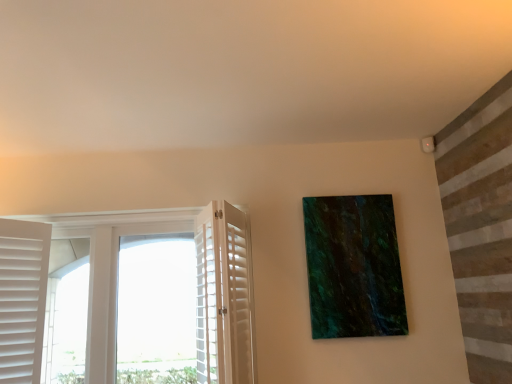
Locate an element on the screen. The height and width of the screenshot is (384, 512). white wooden shutters at left is located at coordinates 109,270.

This screenshot has width=512, height=384. What do you see at coordinates (224, 296) in the screenshot?
I see `white wood screen door at left` at bounding box center [224, 296].

At what (x,y) coordinates should I click in order to perform the action: click on white wooden shutters at left. Please return your answer as a coordinate pair (x, y). This screenshot has width=512, height=384. Looking at the image, I should click on (109, 270).

From a real-world perspective, which is physically below, green marble painting at upper right or white wooden shutters at left?

white wooden shutters at left is physically lower.

Does green marble painting at upper right have a lesser height compared to white wooden shutters at left?

Correct, green marble painting at upper right is not as tall as white wooden shutters at left.

Based on the photo, is green marble painting at upper right turned away from white wooden shutters at left?

That's not correct — green marble painting at upper right is not looking away from white wooden shutters at left.

At what (x,y) coordinates should I click in order to perform the action: click on picture frame behind the white wooden shutters at left. Please return your answer as a coordinate pair (x, y). This screenshot has width=512, height=384. Looking at the image, I should click on (353, 267).

Which object is closer to the camera taking this photo, white wood screen door at left or white wooden shutters at left?

white wood screen door at left is more forward.

Is white wood screen door at left taller or shorter than white wooden shutters at left?

white wood screen door at left is shorter than white wooden shutters at left.

Which of these two, white wood screen door at left or white wooden shutters at left, is thinner?

Thinner between the two is white wood screen door at left.

Find the location of a particular element. window that appears behind the white wood screen door at left is located at coordinates pyautogui.click(x=109, y=270).

Does point (101, 267) lie in front of point (240, 234)?

No, (101, 267) is behind (240, 234).

In the scene shown: Would you say white wooden shutters at left is to the left or to the right of white wood screen door at left in the picture?

white wooden shutters at left is positioned on white wood screen door at left's left side.

Between white wooden shutters at left and white wood screen door at left, which one has larger width?

white wooden shutters at left.

Is white wooden shutters at left oriented away from white wood screen door at left?

No, white wooden shutters at left's orientation is not away from white wood screen door at left.

Is green marble painting at upper right inside white wooden shutters at left?

That's incorrect, green marble painting at upper right is not inside white wooden shutters at left.

Which of these two, white wooden shutters at left or green marble painting at upper right, stands taller?

Standing taller between the two is white wooden shutters at left.

Considering the sizes of white wooden shutters at left and green marble painting at upper right in the image, is white wooden shutters at left wider or thinner than green marble painting at upper right?

In the image, white wooden shutters at left appears to be wider than green marble painting at upper right.

Is white wood screen door at left positioned with its back to green marble painting at upper right?

Yes, white wood screen door at left's orientation is away from green marble painting at upper right.

Could green marble painting at upper right be considered to be inside white wood screen door at left?

No, green marble painting at upper right is not inside white wood screen door at left.

Which of these two, white wood screen door at left or green marble painting at upper right, is smaller?

With smaller size is green marble painting at upper right.

From a real-world perspective, which object rests below the other?

white wood screen door at left, from a real-world perspective.

Does green marble painting at upper right have a larger size compared to white wood screen door at left?

No.

Which is nearer, (390, 202) or (210, 289)?

The point (210, 289) is closer to the camera.

From a real-world perspective, who is located higher, green marble painting at upper right or white wood screen door at left?

green marble painting at upper right.

Could you tell me if green marble painting at upper right is turned towards white wood screen door at left?

No, green marble painting at upper right is not facing towards white wood screen door at left.

Find the location of a particular element. The width and height of the screenshot is (512, 384). window on the left of green marble painting at upper right is located at coordinates (109, 270).

The height and width of the screenshot is (384, 512). What are the coordinates of `screen door to the right of white wooden shutters at left` in the screenshot? It's located at [x=224, y=296].

Considering their positions, is white wooden shutters at left positioned further to white wood screen door at left than green marble painting at upper right?

white wooden shutters at left is further to white wood screen door at left.

Looking at this image, looking at the image, which one is located further to white wooden shutters at left, green marble painting at upper right or white wood screen door at left?

The object further to white wooden shutters at left is green marble painting at upper right.

Based on their spatial positions, is white wood screen door at left or green marble painting at upper right closer to white wooden shutters at left?

white wood screen door at left.

Looking at the image, which one is located further to white wood screen door at left, green marble painting at upper right or white wooden shutters at left?

white wooden shutters at left is positioned further to the anchor white wood screen door at left.

Estimate the real-world distances between objects in this image. Which object is closer to green marble painting at upper right, white wooden shutters at left or white wood screen door at left?

white wood screen door at left is positioned closer to the anchor green marble painting at upper right.

Based on their spatial positions, is white wood screen door at left or white wooden shutters at left closer to green marble painting at upper right?

white wood screen door at left is positioned closer to the anchor green marble painting at upper right.

Where is `screen door located between white wooden shutters at left and green marble painting at upper right in the left-right direction`? This screenshot has width=512, height=384. screen door located between white wooden shutters at left and green marble painting at upper right in the left-right direction is located at coordinates (224, 296).